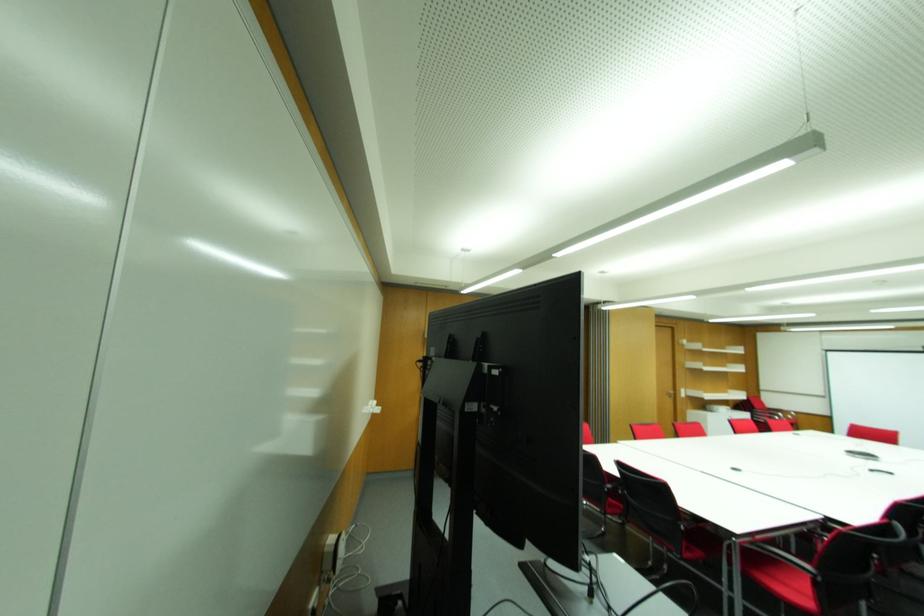
Describe the element at coordinates (787, 559) in the screenshot. Image resolution: width=924 pixels, height=616 pixels. I see `the black chair armrest` at that location.